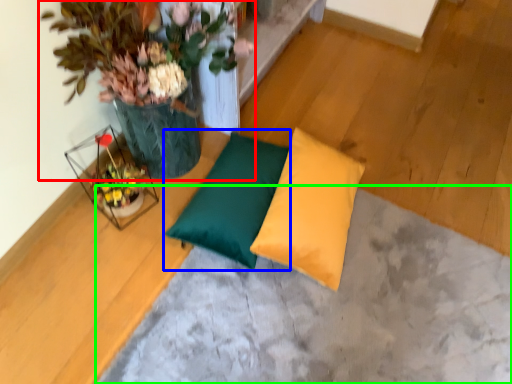
Question: Which object is positioned farthest from houseplant (highlighted by a red box)? Select from pillow (highlighted by a blue box) and concrete (highlighted by a green box).

Choices:
 (A) pillow
 (B) concrete

Answer: (B)